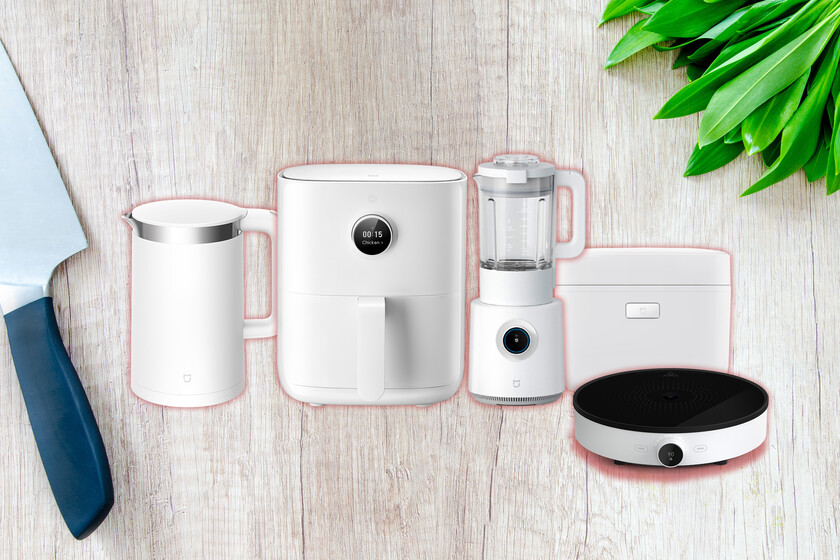
Where is `vacuum`? vacuum is located at coordinates (651, 402).